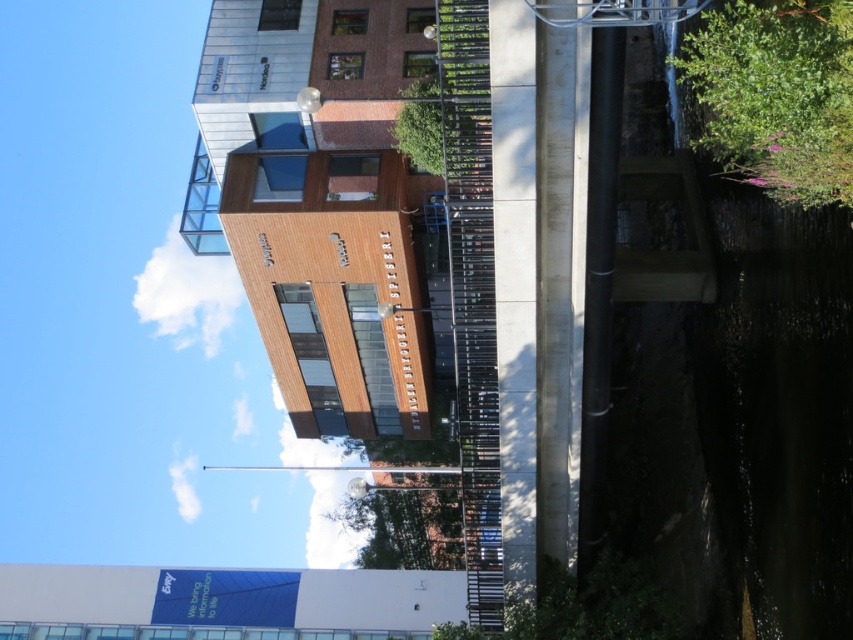
Question: Which of the following is the farthest from the observer?

Choices:
 (A) (366, 524)
 (B) (409, 140)
 (C) (712, 13)

Answer: (A)

Question: Which of the following is the closest to the observer?

Choices:
 (A) green leafy tree at center
 (B) green leafy bush at upper right
 (C) white glossy signboard at lower center

Answer: (B)

Question: Observing the image, what is the correct spatial positioning of green leafy bush at upper right in reference to green leafy tree at upper center?

Choices:
 (A) above
 (B) below

Answer: (A)

Question: Can you confirm if green leafy bush at upper right is thinner than green leafy tree at upper center?

Choices:
 (A) no
 (B) yes

Answer: (A)

Question: Which point appears farthest from the camera in this image?

Choices:
 (A) (817, 36)
 (B) (451, 26)
 (C) (59, 600)

Answer: (C)

Question: Does green leafy bush at upper right lie in front of green leafy tree at center?

Choices:
 (A) yes
 (B) no

Answer: (A)